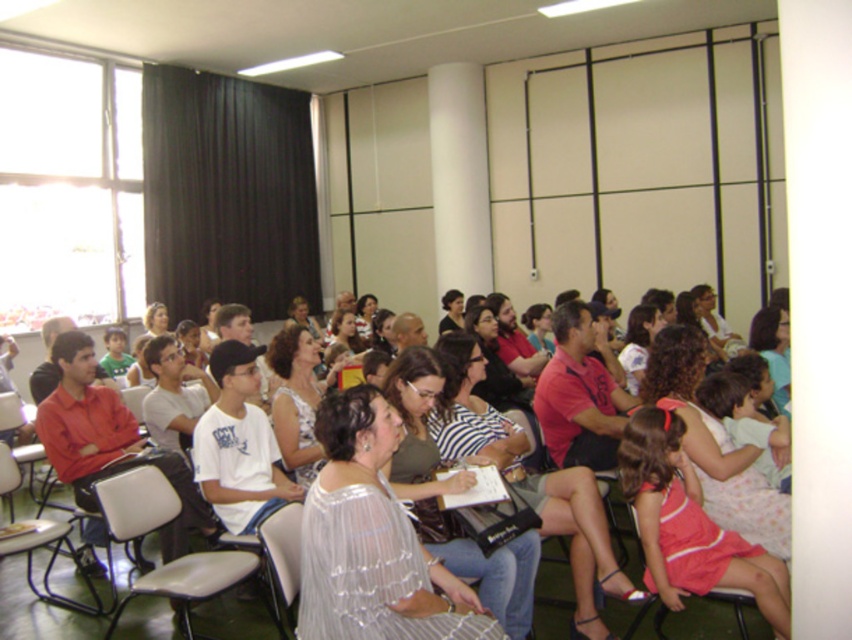
Is black fabric curtain at upper left below white plastic chair at center?

No, black fabric curtain at upper left is not below white plastic chair at center.

Who is more forward, [314,273] or [286,561]?

Point [286,561]

Does point (164, 234) come in front of point (268, 573)?

No, (164, 234) is further to viewer.

Where is `black fabric curtain at upper left`? black fabric curtain at upper left is located at coordinates (226, 193).

Does translucent white blouse at center appear over gray plastic chair at center?

Yes.

Locate an element on the screen. The image size is (852, 640). translucent white blouse at center is located at coordinates click(372, 540).

Does point (314, 563) come in front of point (216, 579)?

Yes, it is.

The image size is (852, 640). In order to click on translucent white blouse at center in this screenshot , I will do point(372,540).

Is point (246, 172) less distant than point (26, 410)?

No.

Is black fabric curtain at upper left below metallic gray chair at left?

No.

This screenshot has width=852, height=640. I want to click on black fabric curtain at upper left, so click(226, 193).